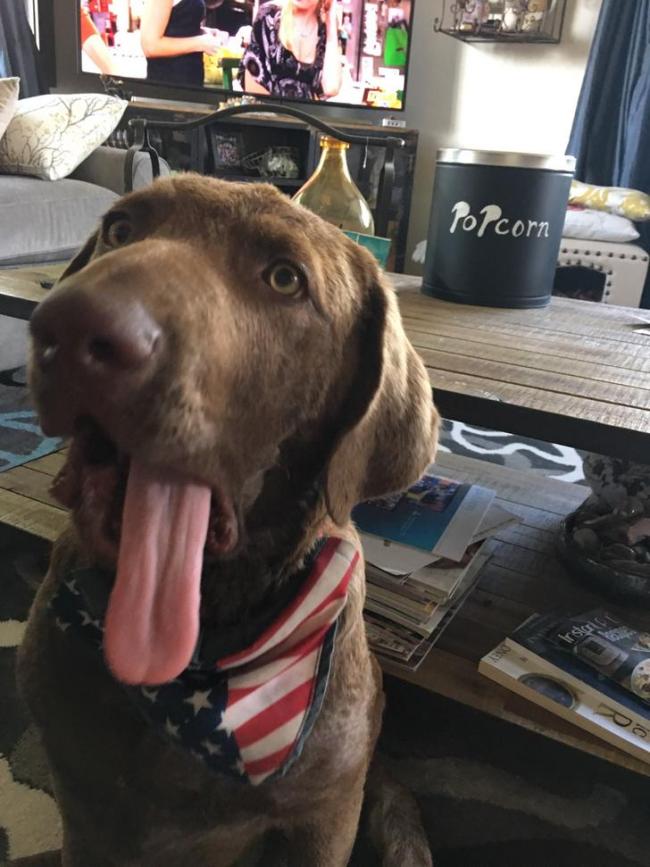
Locate an element on the screen. This screenshot has height=867, width=650. black canister on top shelf/ top of coffee table is located at coordinates (478, 238).